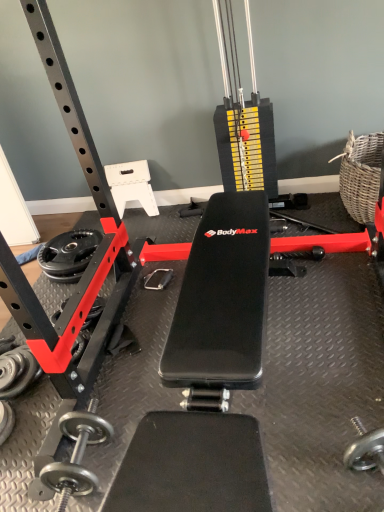
Question: Is black rubber dumbbell at lower left, acting as the 1th dumbbell starting from the top, bigger or smaller than black rubber weight plate at lower left?

Choices:
 (A) big
 (B) small

Answer: (B)

Question: Is point (18, 350) closer or farther from the camera than point (71, 243)?

Choices:
 (A) farther
 (B) closer

Answer: (B)

Question: Considering the real-world distances, which object is farthest from the woven natural basket at right?

Choices:
 (A) silver metallic dumbbell at lower left, the second dumbbell in the top-to-bottom sequence
 (B) black rubber weight plate at lower left
 (C) black rubber dumbbell at lower left, acting as the 1th dumbbell starting from the top

Answer: (A)

Question: Which is farther from the silver metallic dumbbell at lower left, the first dumbbell positioned from the bottom?

Choices:
 (A) woven natural basket at right
 (B) black rubber weight plate at lower left
 (C) black rubber dumbbell at lower left, which is the 2th dumbbell from bottom to top

Answer: (A)